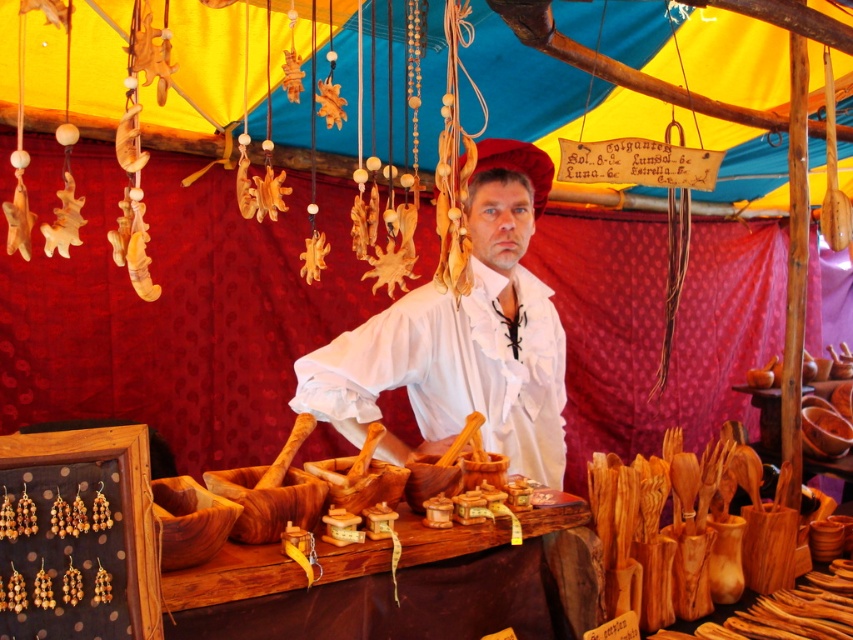
You are a customer at a craft fair and see the white matte shirt at center and the wooden at center on display. Which item is wider?

The wooden at center is wider than the white matte shirt at center.

You are a customer at a craft fair and see the white matte shirt at center and the wooden at center on the table. You want to pick up both items to examine them. Can you reach both items without moving your position?

The white matte shirt at center is 20.82 inches away from wooden at center. Since the distance between them is 20.82 inches, you can comfortably reach both items without needing to move your position as they are within a typical arm span.

You are a customer at a craft fair and see the white matte shirt at center and the wooden at center on the table. Which item is placed higher on the table?

The white matte shirt at center is above the wooden at center, so it is placed higher on the table.